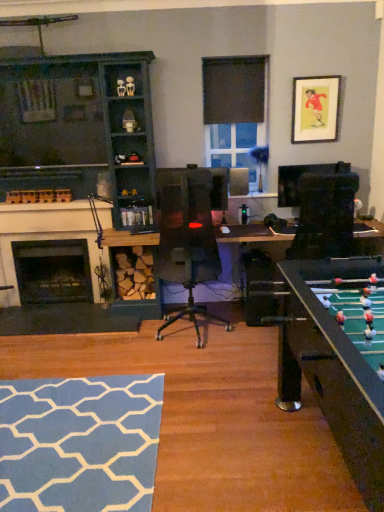
Where is `vacant space to the right of blue fabric rug at lower left`? The image size is (384, 512). vacant space to the right of blue fabric rug at lower left is located at coordinates (223, 419).